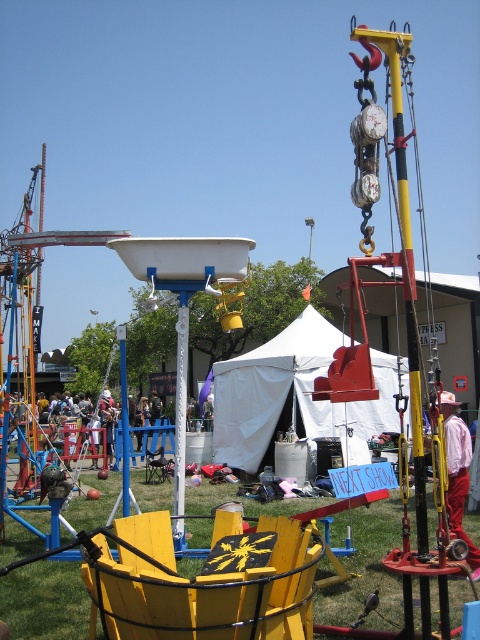
Question: Is white fabric tent at center positioned behind white cotton shirt at right?

Choices:
 (A) no
 (B) yes

Answer: (B)

Question: In this image, where is white fabric tent at center located relative to green grass at lower center?

Choices:
 (A) below
 (B) above

Answer: (B)

Question: Can you confirm if white cotton shirt at right is smaller than green grass at lower center?

Choices:
 (A) no
 (B) yes

Answer: (A)

Question: Among these points, which one is nearest to the camera?

Choices:
 (A) (310, 579)
 (B) (355, 504)
 (C) (459, 474)
 (D) (300, 321)

Answer: (A)

Question: Which of these objects is positioned closest to the yellow painted wood chair at lower center?

Choices:
 (A) white cotton shirt at right
 (B) white fabric tent at center

Answer: (A)

Question: Among these points, which one is farthest from the camera?

Choices:
 (A) (453, 465)
 (B) (373, 419)
 (C) (314, 512)
 (D) (278, 579)

Answer: (B)